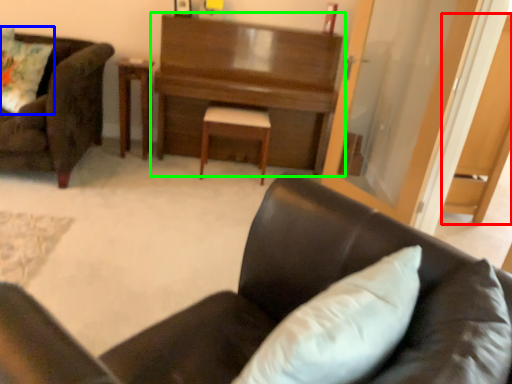
Question: Which object is positioned closest to dark (highlighted by a red box)? Select from pillow (highlighted by a blue box) and desk (highlighted by a green box).

Choices:
 (A) pillow
 (B) desk

Answer: (B)